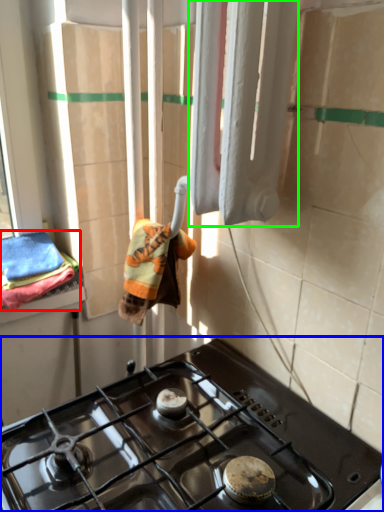
Question: Which is nearer to the bath towel (highlighted by a red box)? gas stove (highlighted by a blue box) or curtain (highlighted by a green box).

Choices:
 (A) gas stove
 (B) curtain

Answer: (A)